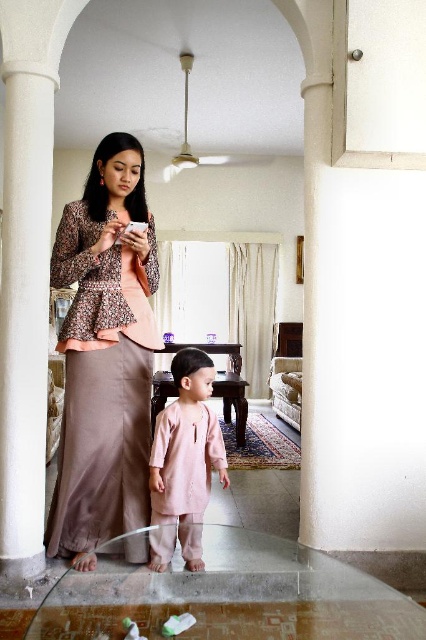
Can you confirm if matte brown peplum top at center is positioned above pale pink fabric at center?

Indeed, matte brown peplum top at center is positioned over pale pink fabric at center.

Is point (115, 211) farther from camera compared to point (219, 461)?

No, (115, 211) is closer to viewer.

Describe the element at coordinates (104, 353) in the screenshot. The width and height of the screenshot is (426, 640). I see `matte brown peplum top at center` at that location.

Locate an element on the screen. The width and height of the screenshot is (426, 640). matte brown peplum top at center is located at coordinates (104, 353).